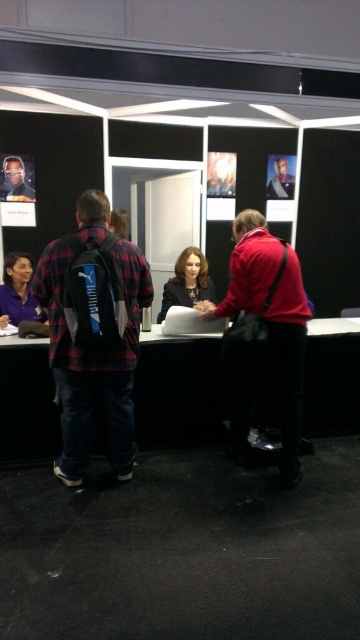
You are organizing a convention booth and need to place a 1.2 meter wide banner between the black glossy table at center and the purple fabric shirt at lower left. Can the banner fit between them based on their widths?

The black glossy table at center is wider than the purple fabric shirt at lower left. Since the banner is 1.2 meters wide, it depends on the actual width of the table and shirt. However, the description only states the table is wider, not the exact measurements. Therefore, we cannot confirm if the banner will fit without more specific dimensions.

You are standing in the convention booth described. There is a point marked at coordinates [263,332]. What object is located at that point?

The object located at point [263,332] is the matte red jacket at center.